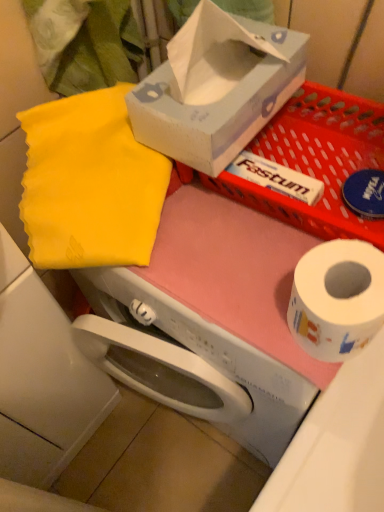
Question: In terms of width, does yellow fabric at upper left look wider or thinner when compared to white paper at right?

Choices:
 (A) thin
 (B) wide

Answer: (B)

Question: From a real-world perspective, is yellow fabric at upper left positioned above or below white paper at right?

Choices:
 (A) above
 (B) below

Answer: (B)

Question: Which object is positioned farthest from the yellow fabric at upper left?

Choices:
 (A) white paper at right
 (B) matte white tissue box at upper center

Answer: (A)

Question: Which object is the closest to the yellow fabric at upper left?

Choices:
 (A) white paper at right
 (B) matte white tissue box at upper center

Answer: (B)